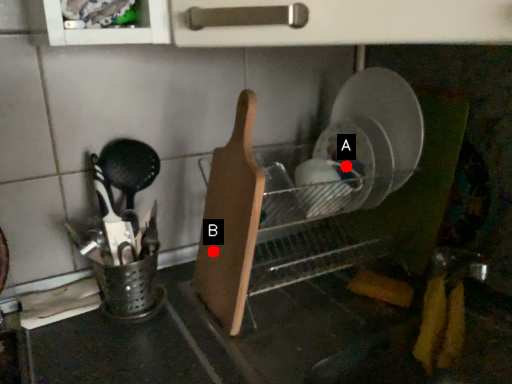
Question: Two points are circled on the image, labeled by A and B beside each circle. Among these points, which one is farthest from the camera?

Choices:
 (A) A is further
 (B) B is further

Answer: (A)